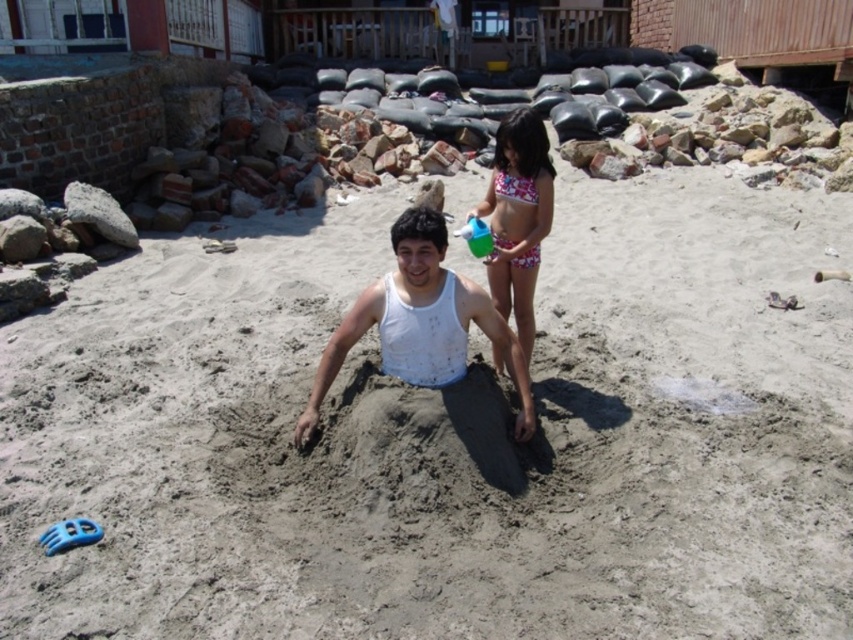
Is gray sandy beach at center smaller than pink floral swimsuit at upper center?

Yes.

Can you confirm if gray sandy beach at center is positioned to the left of pink floral swimsuit at upper center?

No, gray sandy beach at center is not to the left of pink floral swimsuit at upper center.

Describe the element at coordinates (445, 436) in the screenshot. I see `gray sandy beach at center` at that location.

Identify the location of gray sandy beach at center. (445, 436).

Measure the distance from gray sandy beach at center to white matte tank top at center.

The distance of gray sandy beach at center from white matte tank top at center is 5.80 feet.

Is the position of gray sandy beach at center more distant than that of white matte tank top at center?

Yes, gray sandy beach at center is further from the viewer.

Who is more forward, (x=703, y=509) or (x=517, y=417)?

Point (x=703, y=509) is more forward.

What are the coordinates of `gray sandy beach at center` in the screenshot? It's located at (445, 436).

Is white matte tank top at center wider than pink floral swimsuit at upper center?

Yes.

Can you confirm if white matte tank top at center is bigger than pink floral swimsuit at upper center?

Yes.

Does point (380, 320) lie in front of point (514, 307)?

Yes, it is in front of point (514, 307).

Where is `white matte tank top at center`? The image size is (853, 640). white matte tank top at center is located at coordinates (421, 323).